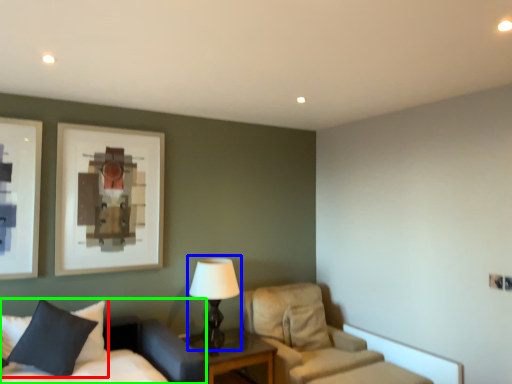
Question: Estimate the real-world distances between objects in this image. Which object is farther from pillow (highlighted by a red box), table lamp (highlighted by a blue box) or bed (highlighted by a green box)?

Choices:
 (A) table lamp
 (B) bed

Answer: (A)